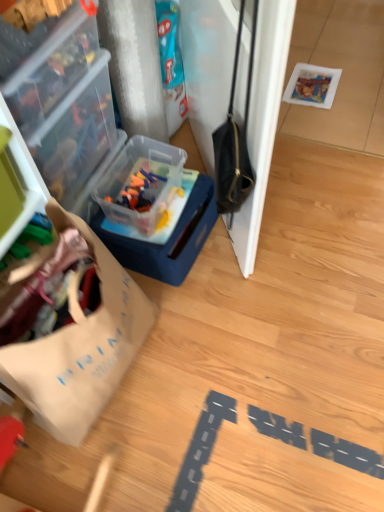
Where is `free spot to the right of brown paper bag at left`? The height and width of the screenshot is (512, 384). free spot to the right of brown paper bag at left is located at coordinates (210, 364).